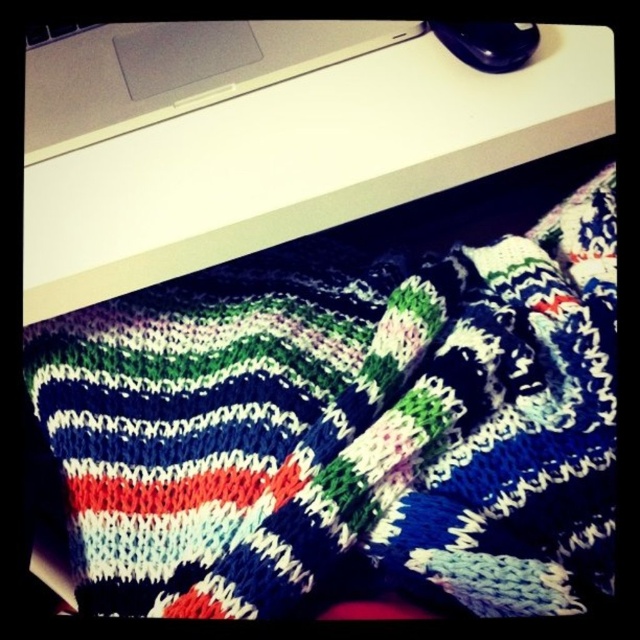
You are organizing your workspace and need to place a new monitor on the desk. The monitor is 25 cm tall. Can the white plastic computer desk at upper center accommodate the monitor without it being taller than the white matte laptop at upper center?

The white plastic computer desk at upper center is taller than the white matte laptop at upper center. Since the desk is taller than the laptop, placing a 25 cm tall monitor on the desk would depend on the desk height. However, the laptop height isn not provided, so we can only confirm the desk can accommodate the monitor as long as its height allows. But according to the description, the desk is taller than the laptop, so if the monitor is 25 cm and the laptop is shorter than that, the desk can hold it.

You are a photographer trying to capture the knitted item in the image. You notice two points marked on the image at coordinates point [29,285] and point [339,436]. Which point is closer to you when you take the photo?

Point [29,285] is further to the viewer than point [339,436], so the point closer to you is point [29,285].